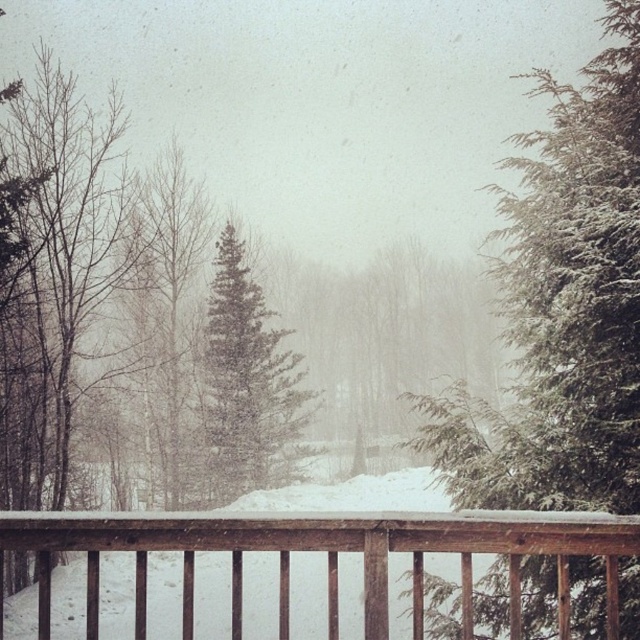
You are standing on the wooden deck and want to know which object is wider between the green textured evergreen tree at right and the brown wooden railing at center. Can you determine this?

The green textured evergreen tree at right is wider than the brown wooden railing at center according to the description.

You are standing on the wooden deck and want to place a small snowman between the green textured evergreen tree at right and the green matte evergreen tree at center. Given that the snowman requires 1 meter of space, can you fit it there?

The green textured evergreen tree at right is wider than the green matte evergreen tree at center. Since the snowman needs 1 meter of space, the available space between them depends on their widths. However, without knowing the exact distance between the trees, we cannot confirm if there is enough space. Please measure the gap first.